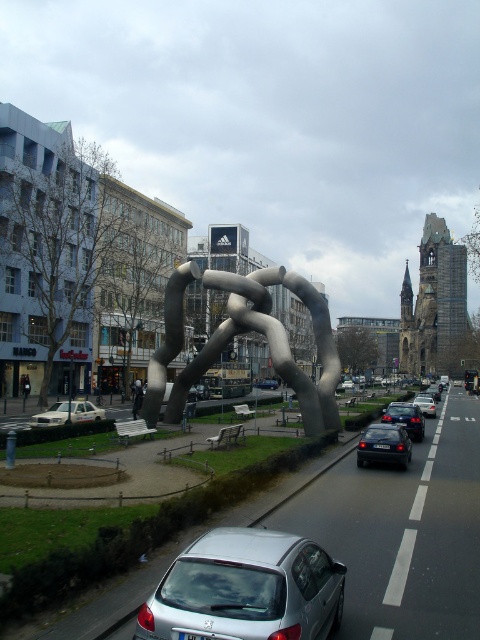
Is polished silver sculpture at center positioned at the back of metallic silver car at center?

No.

Does polished silver sculpture at center have a lesser width compared to metallic silver car at center?

In fact, polished silver sculpture at center might be wider than metallic silver car at center.

Locate an element on the screen. This screenshot has height=640, width=480. polished silver sculpture at center is located at coordinates (268, 342).

The image size is (480, 640). What do you see at coordinates (406, 419) in the screenshot?
I see `shiny black sedan at center-right` at bounding box center [406, 419].

Consider the image. Between shiny black sedan at center-right and shiny black sedan at center, which one has less height?

shiny black sedan at center is shorter.

Where is `shiny black sedan at center-right`? shiny black sedan at center-right is located at coordinates (406, 419).

Measure the distance between point (405, 449) and camera.

Point (405, 449) is 14.44 meters from camera.

Does black metallic car at center have a greater height compared to shiny black sedan at center-right?

Incorrect, black metallic car at center's height is not larger of shiny black sedan at center-right's.

Locate an element on the screen. This screenshot has width=480, height=640. black metallic car at center is located at coordinates (384, 445).

Find the location of `black metallic car at center`. black metallic car at center is located at coordinates (384, 445).